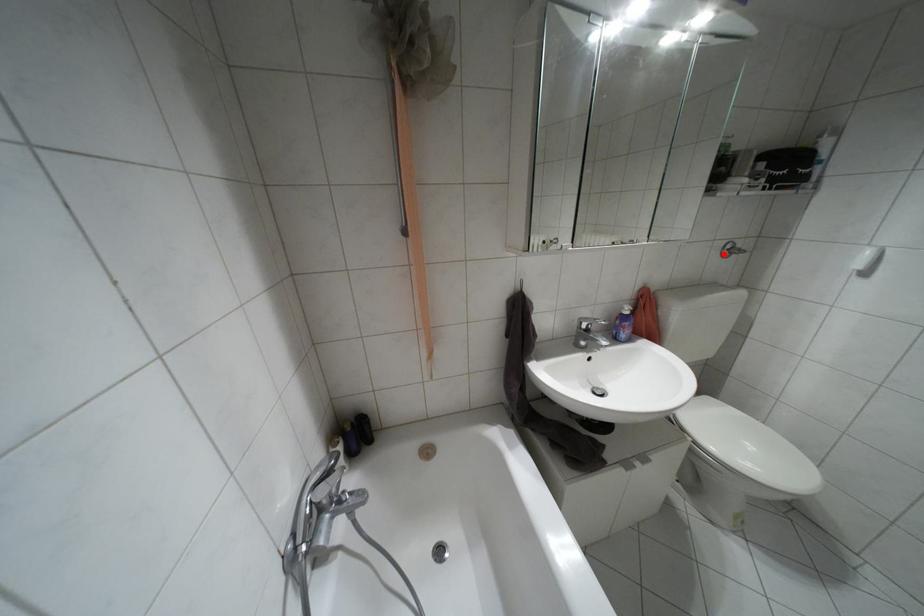
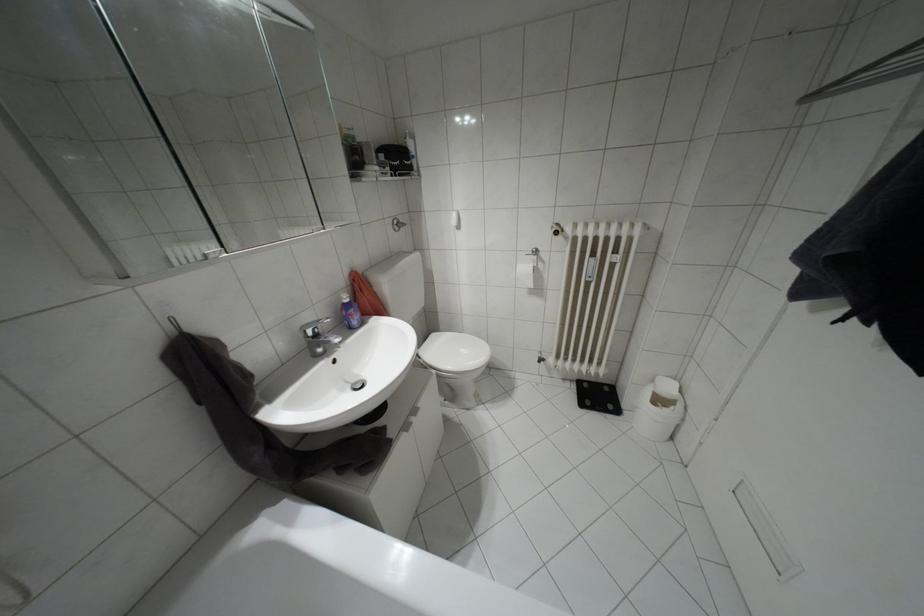
Find the pixel in the second image that matches the highlighted location in the first image.

(395, 229)